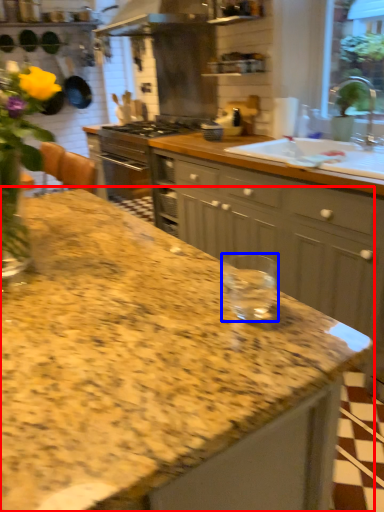
Question: Among these objects, which one is nearest to the camera, countertop (highlighted by a red box) or glass jar (highlighted by a blue box)?

Choices:
 (A) countertop
 (B) glass jar

Answer: (B)